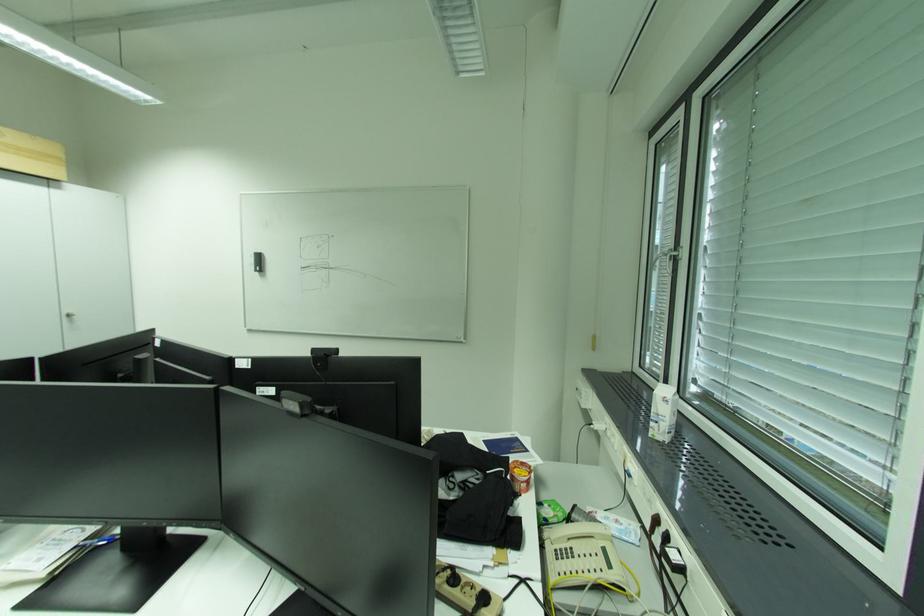
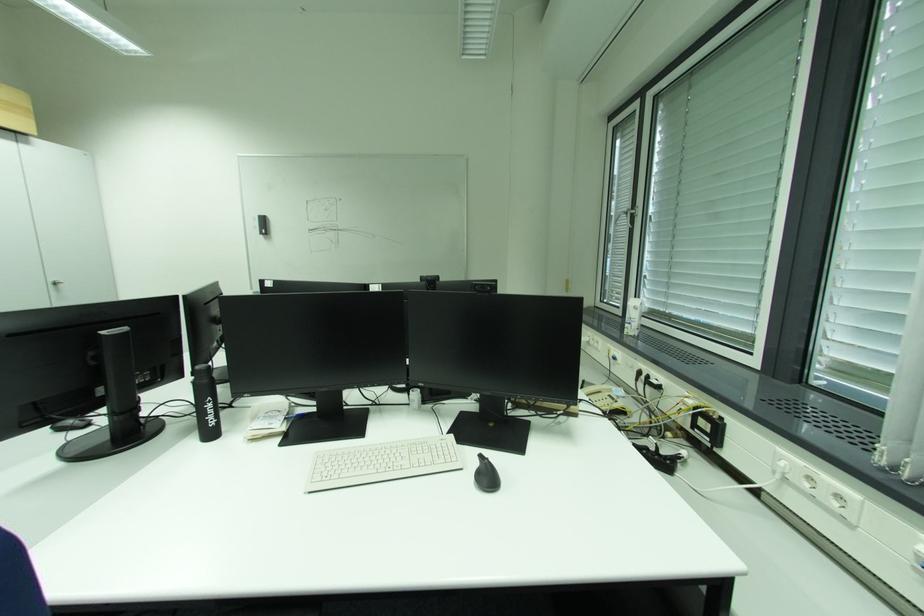
Based on the photo, which direction would the cameraman need to move to produce the second image?

The cameraman moved toward left, backward.